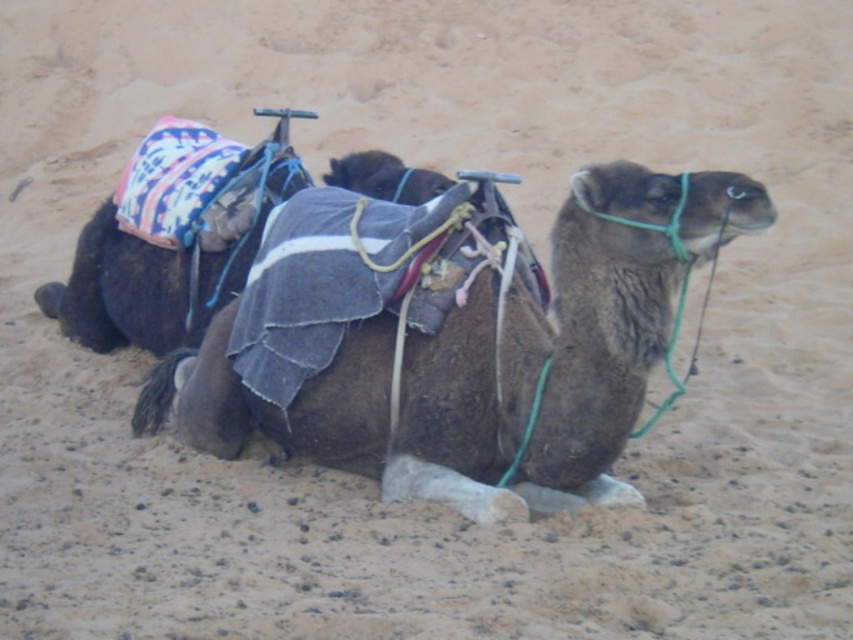
You are standing in front of the two camels in the image. You notice two points marked on the ground at coordinates point (387, 227) and point (109, 308). Which point is closer to you?

Point (387, 227) is closer to the camera than point (109, 308).